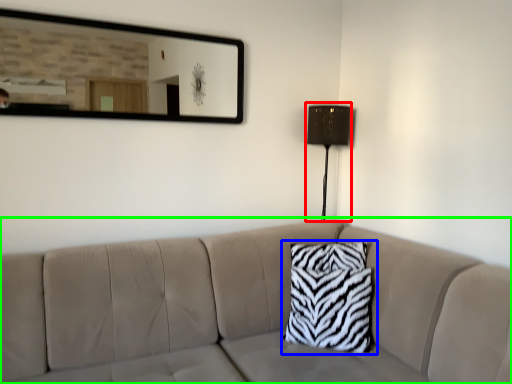
Question: Estimate the real-world distances between objects in this image. Which object is farther from table lamp (highlighted by a red box), pillow (highlighted by a blue box) or studio couch (highlighted by a green box)?

Choices:
 (A) pillow
 (B) studio couch

Answer: (B)